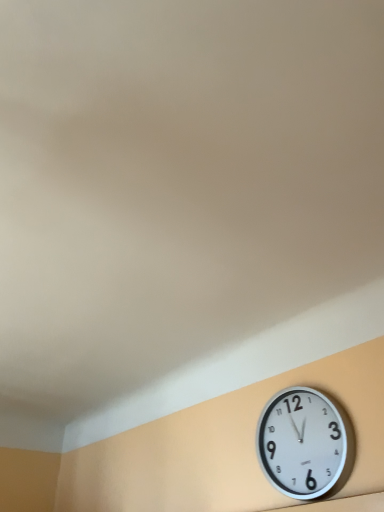
Find the location of a particular element. This screenshot has height=512, width=384. white metallic wall clock at lower right is located at coordinates (302, 443).

Image resolution: width=384 pixels, height=512 pixels. What do you see at coordinates (302, 443) in the screenshot? I see `white metallic wall clock at lower right` at bounding box center [302, 443].

At what (x,y) coordinates should I click in order to perform the action: click on white metallic wall clock at lower right. Please return your answer as a coordinate pair (x, y). This screenshot has width=384, height=512. Looking at the image, I should click on 302,443.